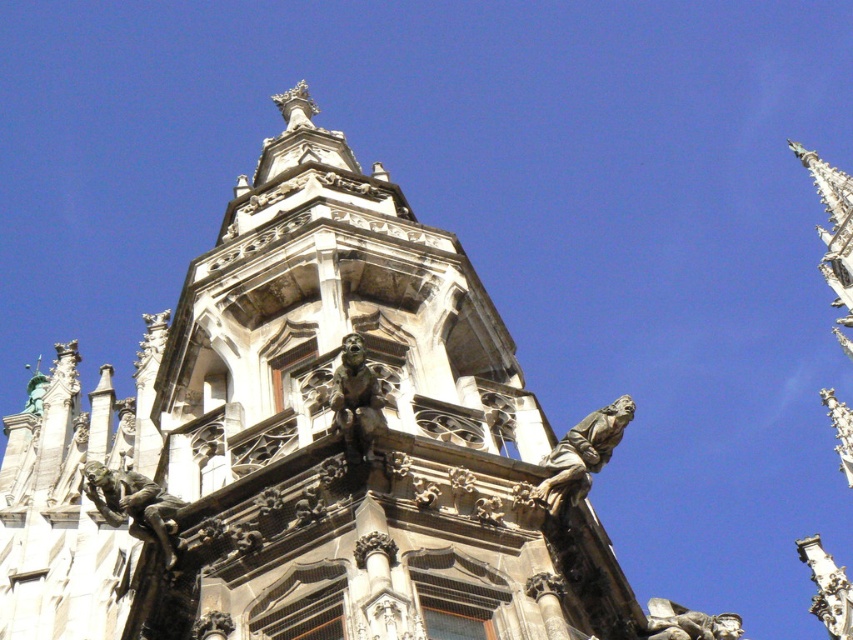
Question: Which point is farther to the camera?

Choices:
 (A) dark gray stone gargoyle at upper right
 (B) polished stone gargoyle at lower right
 (C) polished bronze gargoyle at center
 (D) polished bronze gargoyle at lower left

Answer: (B)

Question: In this image, where is dark gray stone gargoyle at upper right located relative to polished stone gargoyle at lower right?

Choices:
 (A) below
 (B) above

Answer: (B)

Question: Can you confirm if polished bronze gargoyle at lower left is wider than polished stone gargoyle at upper right?

Choices:
 (A) no
 (B) yes

Answer: (A)

Question: Is dark gray stone gargoyle at upper right below green patina statue at upper left?

Choices:
 (A) yes
 (B) no

Answer: (A)

Question: Which of the following is the closest to the observer?

Choices:
 (A) (848, 472)
 (B) (115, 520)

Answer: (B)

Question: Which object is the closest to the green patina statue at upper left?

Choices:
 (A) polished bronze gargoyle at lower left
 (B) dark gray stone gargoyle at upper right
 (C) polished bronze gargoyle at center
 (D) polished stone gargoyle at upper right

Answer: (A)